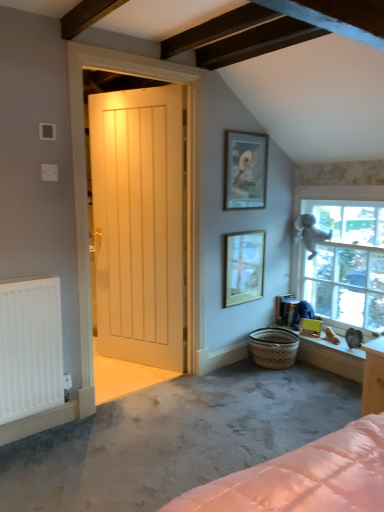
Locate an element on the screen. vacant space situated above white wooden door at center (from a real-world perspective) is located at coordinates (134, 89).